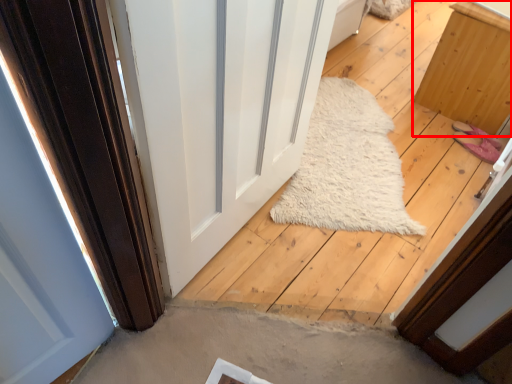
Question: Where is furniture (annotated by the red box) located in relation to door in the image?

Choices:
 (A) right
 (B) left

Answer: (A)